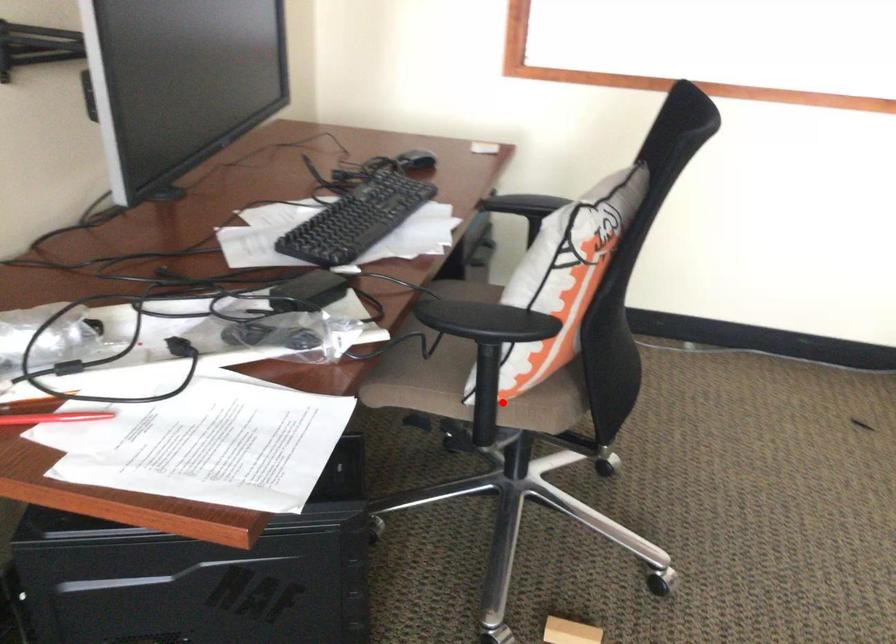
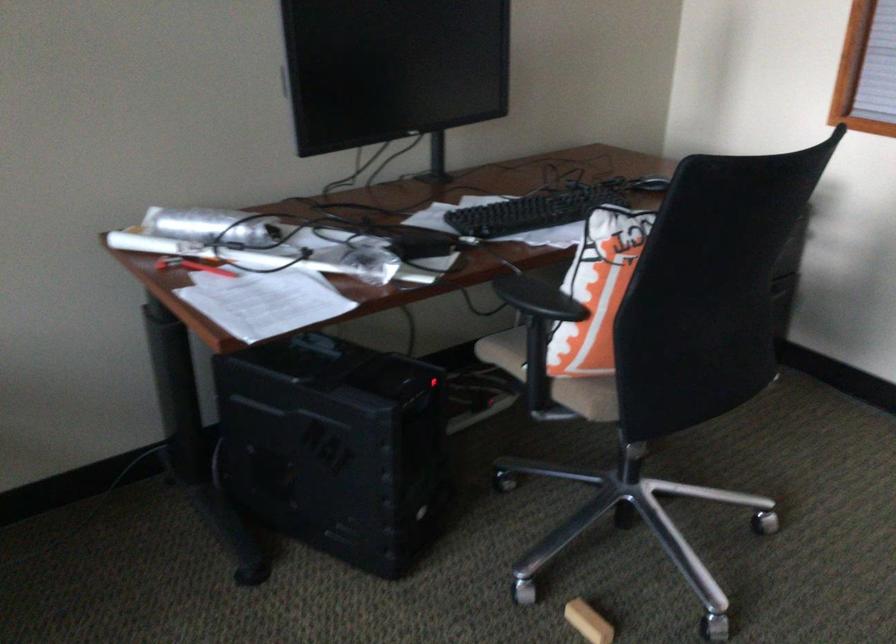
Where in the second image is the point corresponding to the highlighted location from the first image?

(552, 377)